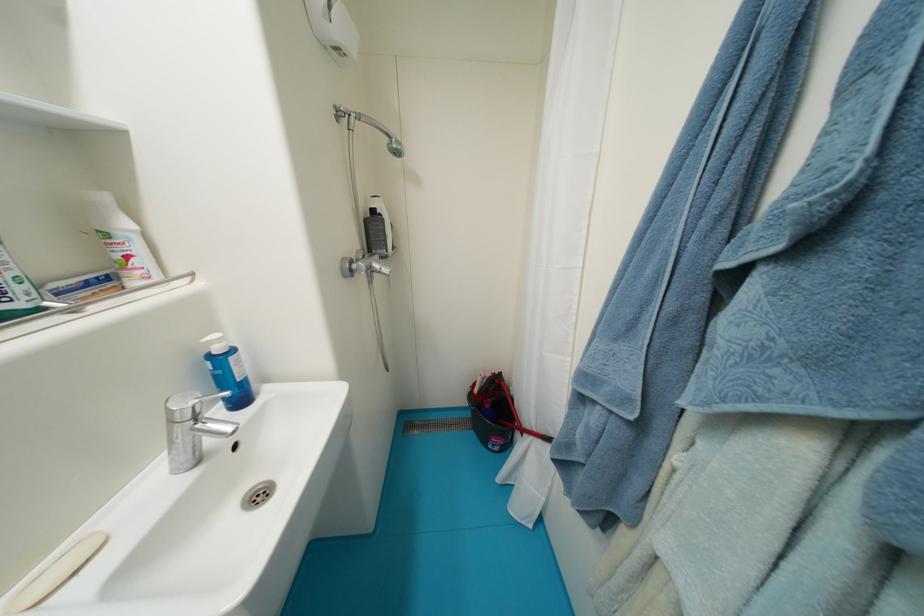
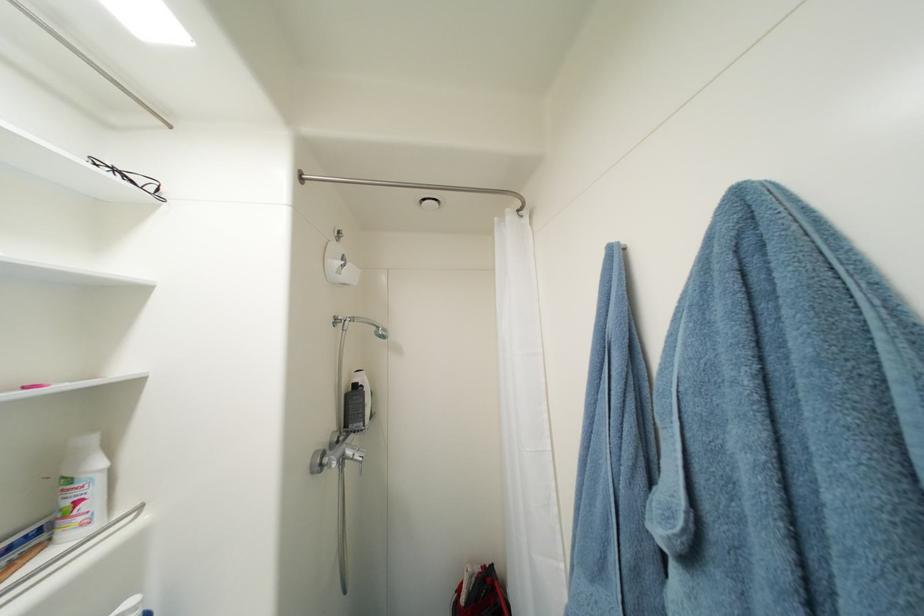
In the second image, find the point that corresponds to [383,267] in the first image.

(356, 454)